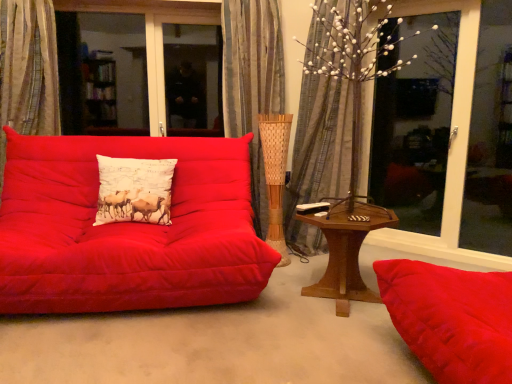
Identify the location of vacant position to the left of wooden hexagonal table at center. The width and height of the screenshot is (512, 384). click(x=264, y=304).